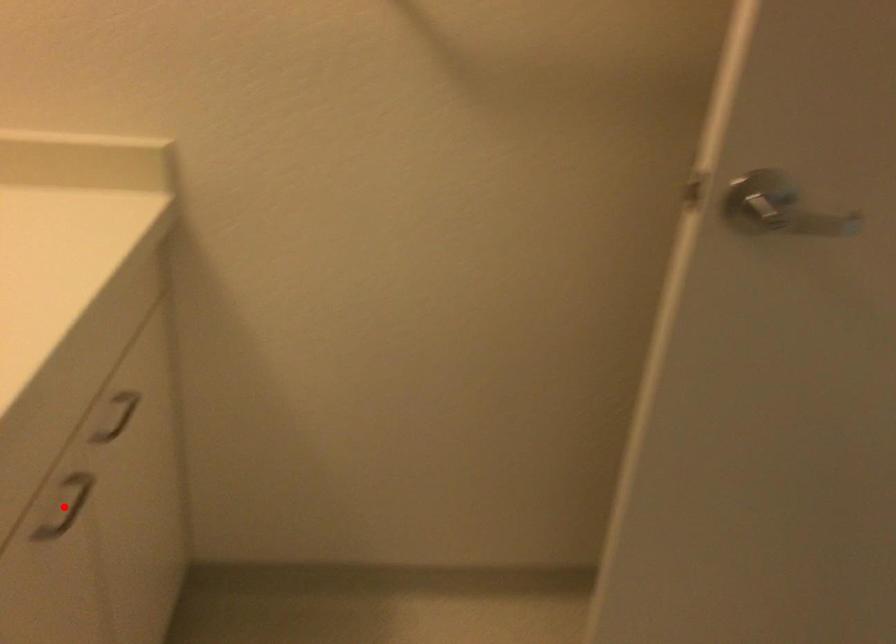
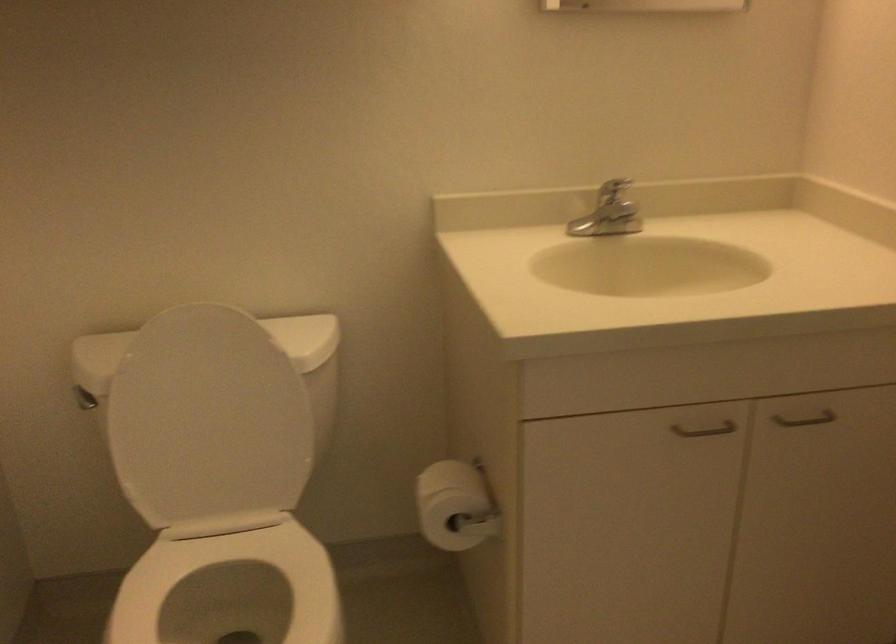
Question: I am providing you with two images of the same scene from different viewpoints. A red point is marked on the first image. At the location where the point appears in image 1, is it still visible in image 2?

Choices:
 (A) Yes
 (B) No

Answer: (B)